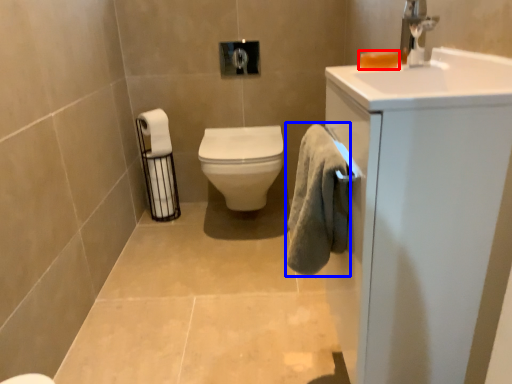
Question: Which of the following is the farthest to the observer, soap (highlighted by a red box) or bath towel (highlighted by a blue box)?

Choices:
 (A) soap
 (B) bath towel

Answer: (A)